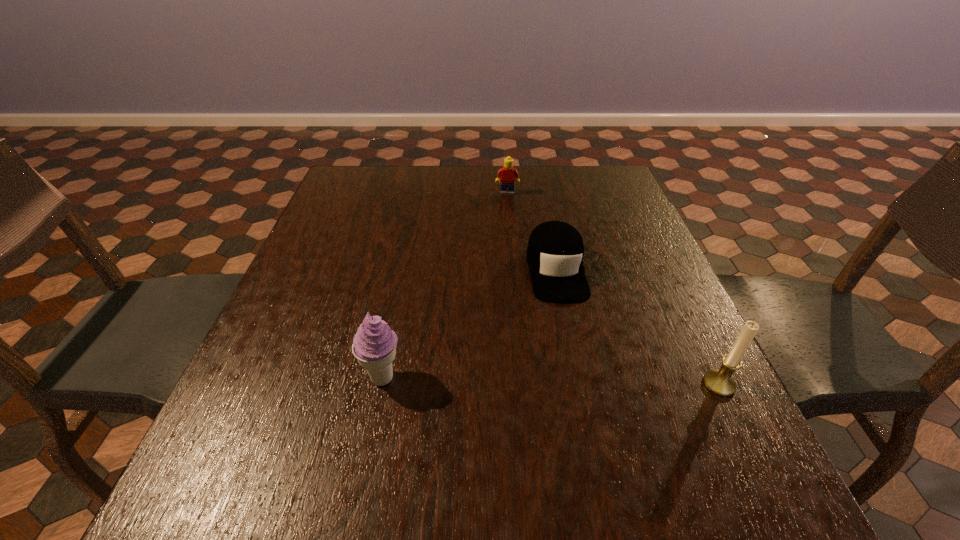
The image size is (960, 540). Find the location of `vacant area situated 0.100m on the front-facing side of the third tallest object`. vacant area situated 0.100m on the front-facing side of the third tallest object is located at coordinates (506, 214).

This screenshot has height=540, width=960. Identify the location of free space located 0.160m on the front-facing side of the shortest object. (576, 361).

I want to click on vacant region located 0.180m on the front-facing side of the shortest object, so click(578, 369).

In order to click on vacant area situated on the front-facing side of the shortest object in this screenshot , I will do `click(569, 330)`.

The width and height of the screenshot is (960, 540). Find the location of `object at the far edge`. object at the far edge is located at coordinates (507, 174).

Locate an element on the screen. The height and width of the screenshot is (540, 960). object present at the right edge is located at coordinates (720, 382).

The image size is (960, 540). Identify the location of vacant space at the far edge of the desktop. (540, 171).

The height and width of the screenshot is (540, 960). What are the coordinates of `vacant space at the near edge of the desktop` in the screenshot? It's located at (521, 439).

Locate an element on the screen. The image size is (960, 540). free spot at the left edge of the desktop is located at coordinates (370, 215).

Where is `free space at the right edge of the desktop`? free space at the right edge of the desktop is located at coordinates (637, 310).